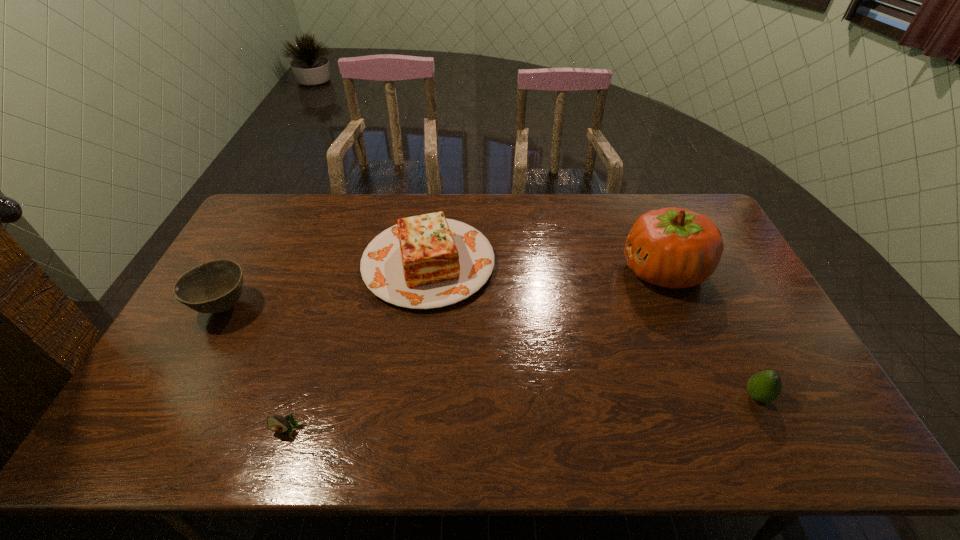
You are a GUI agent. You are given a task and a screenshot of the screen. Output one action in this format:
    pyautogui.click(x=<x>, y=<y>)
    Task: Click on the pumpkin
    This screenshot has width=960, height=540.
    Given the screenshot: What is the action you would take?
    pyautogui.click(x=675, y=248)

You are a GUI agent. You are given a task and a screenshot of the screen. Output one action in this format:
    pyautogui.click(x=<x>, y=<y>)
    Task: Click on the third object from left to right
    
    Given the screenshot: What is the action you would take?
    tap(427, 261)

What are the coordinates of `the leftmost object` in the screenshot? It's located at (215, 286).

Find the location of a particular element. Image resolution: width=960 pixels, height=540 pixels. the farther avocado is located at coordinates 765,386.

Image resolution: width=960 pixels, height=540 pixels. In order to click on the second nearest object in this screenshot , I will do `click(765, 386)`.

Locate an element on the screen. the second object from left to right is located at coordinates (275, 423).

At what (x,y) coordinates should I click in order to perform the action: click on the nearest object. Please return your answer as a coordinate pair (x, y). Looking at the image, I should click on (275, 423).

Find the location of a particular element. This screenshot has height=540, width=960. free space located 0.380m on the side of the pumpkin with the cute face is located at coordinates click(503, 272).

The height and width of the screenshot is (540, 960). I want to click on free spot located 0.090m on the side of the pumpkin with the cute face, so (593, 272).

Identify the location of vacant area located on the side of the pumpkin with the cute face. The image size is (960, 540). (582, 272).